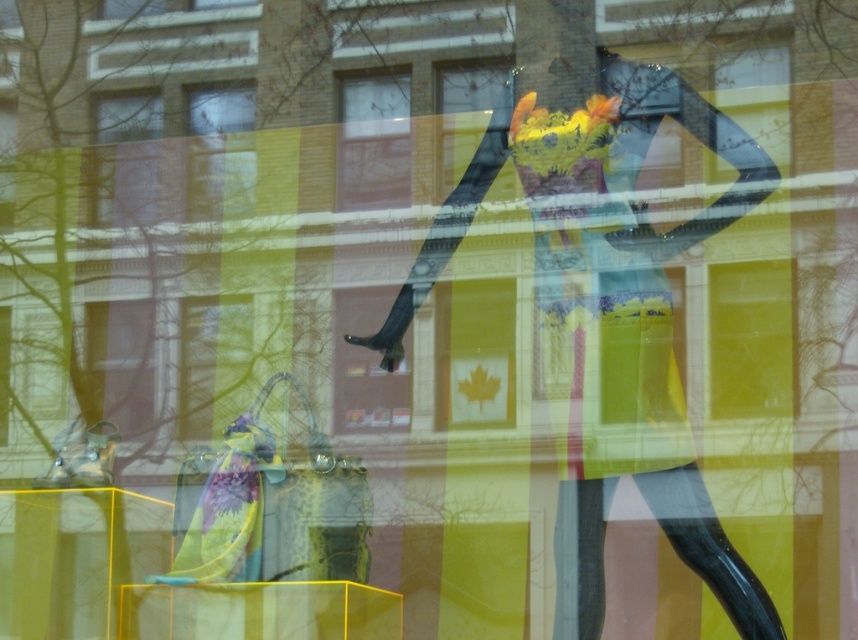
You are a customer standing in front of the store window. You want to take a photo of the floral dress at center. Where should you position yourself to capture the dress in the center of your camera view?

To capture the floral dress at center in the center of your camera view, position yourself directly in front of the dress, aligning your camera with the coordinates mentioned in the description, which is at point (x=596, y=212).

Looking at this image, you are a customer looking at the store display through the window. Can you see the matte glass window at upper center through the matte yellow purse at center?

The matte yellow purse at center is in front of the matte glass window at upper center, so the window cannot be seen through the purse.

You are a customer looking at the store window display. You notice the floral dress at center and the matte yellow purse at center. Which item is positioned higher in the display?

The floral dress at center is positioned higher than the matte yellow purse at center.